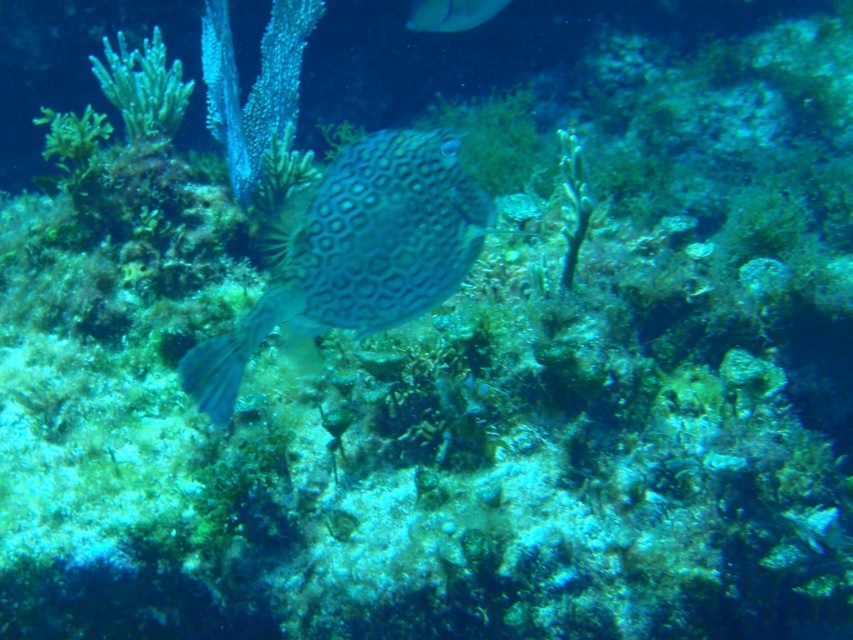
You are a marine biologist studying the boxfish in this underwater scene. You notice a point marked at coordinates (355,253). Which object in the image does this point correspond to?

The point at coordinates (355,253) corresponds to the patterned skin fish at center.

You are a marine biologist observing the underwater scene. You notice the green matte algae at upper left and the smooth yellow fish at upper center. Based on their positions, which object is located below the other?

The green matte algae at upper left is positioned under the smooth yellow fish at upper center, meaning the algae is below the fish.

You are a marine biologist observing the underwater scene. You notice a patterned skin fish at center and a smooth yellow fish at upper center. Which fish has a greater body width?

The patterned skin fish at center has a greater body width than the smooth yellow fish at upper center according to the description provided.